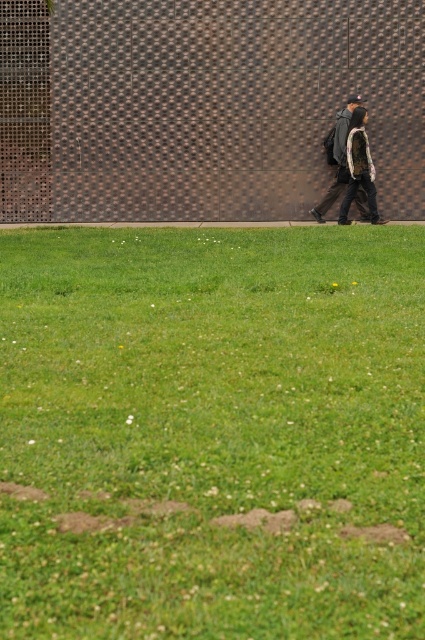
You are standing at the center of the image and want to find the green grass at lower center. According to the coordinates provided, in which direction should you look to locate it?

The green grass at lower center is located at coordinates point (212, 433). Since the coordinates are given as x,y values where lower center corresponds to a position slightly to the right and slightly below the center point, you should look downward and to the right from the center to find it.

You are planning to place a small picnic basket on the ground. Given the green grass at lower center and the dark gray backpack at center, which location would be more suitable for placing the basket to ensure it stays stable?

The green grass at lower center is larger in size compared to the dark gray backpack at center, so placing the picnic basket on the green grass at lower center would provide a more stable and spacious area.

You are standing in the park and want to determine the relative positions of two points marked in the image. Which of the two points, point (135, 461) or point (334, 186), is closer to you?

Point (135, 461) is closer to the camera than point (334, 186).